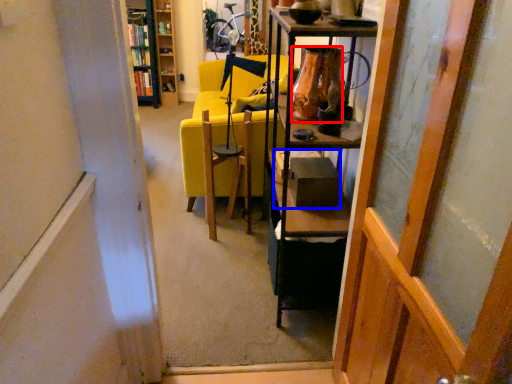
Question: Among these objects, which one is nearest to the camera, vase (highlighted by a red box) or box (highlighted by a blue box)?

Choices:
 (A) vase
 (B) box

Answer: (A)